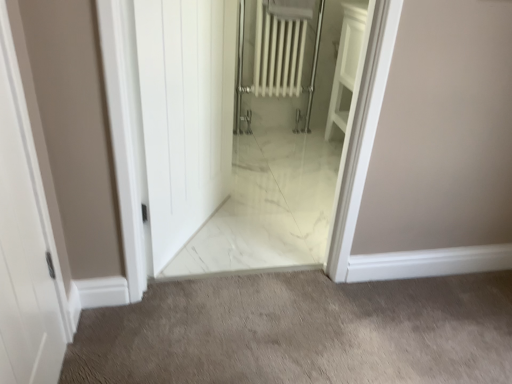
Identify the location of free space behind white matte door at left, which ranks as the 2th door in right-to-left order. The image size is (512, 384). (101, 355).